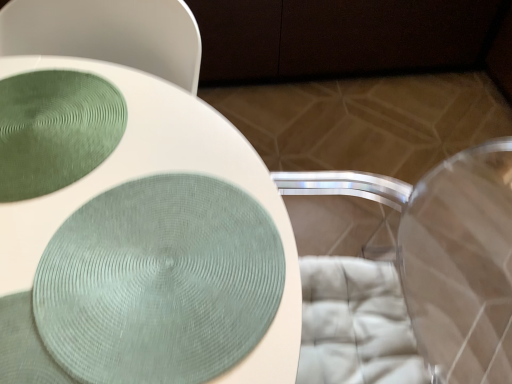
Identify the location of vacant space situated above matte green fabric at center (from a real-world perspective). (103, 206).